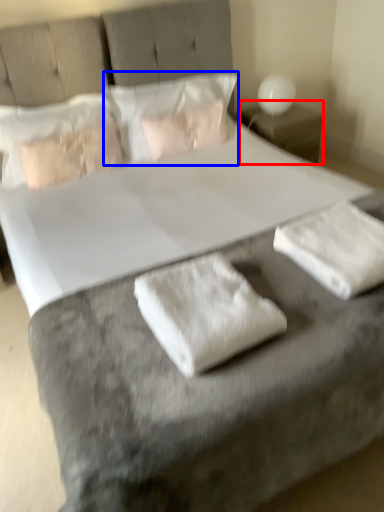
Question: Which point is further to the camera, nightstand (highlighted by a red box) or pillow (highlighted by a blue box)?

Choices:
 (A) nightstand
 (B) pillow

Answer: (A)